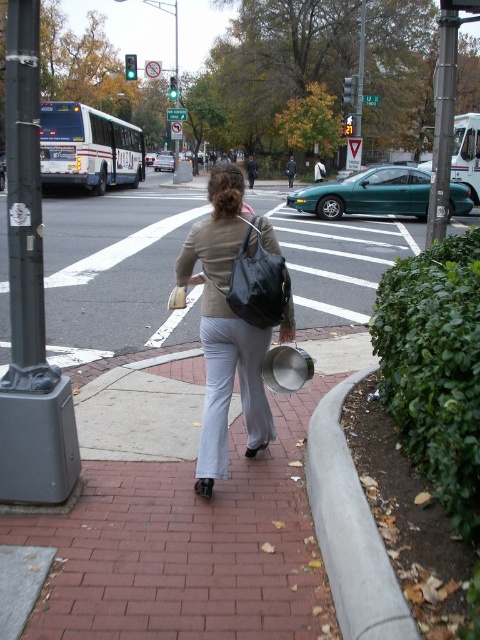
Can you confirm if brick pavement at center is positioned to the left of metallic pole at center-right?

Indeed, brick pavement at center is positioned on the left side of metallic pole at center-right.

Between point (113, 340) and point (442, 4), which one is positioned behind?

The point (113, 340) is more distant.

Where is `brick pavement at center`? brick pavement at center is located at coordinates (115, 273).

Between brick pavement at center and matte black backpack at center, which one appears on the left side from the viewer's perspective?

matte black backpack at center

Locate an element on the screen. brick pavement at center is located at coordinates (115, 273).

Does point (219, 445) come behind point (447, 67)?

No, it is in front of (447, 67).

Is matte black backpack at center below metallic pole at center-right?

Yes.

Locate an element on the screen. The width and height of the screenshot is (480, 640). matte black backpack at center is located at coordinates (223, 326).